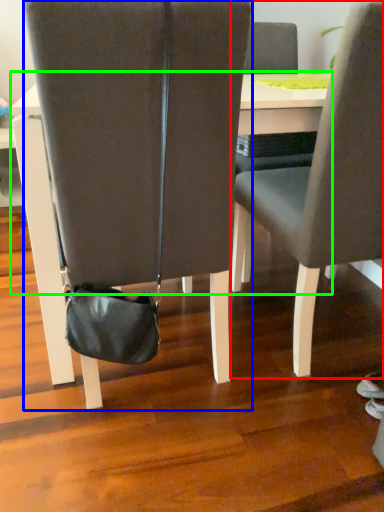
Question: Based on their relative distances, which object is nearer to chair (highlighted by a red box)? Choose from chair (highlighted by a blue box) and table (highlighted by a green box).

Choices:
 (A) chair
 (B) table

Answer: (B)